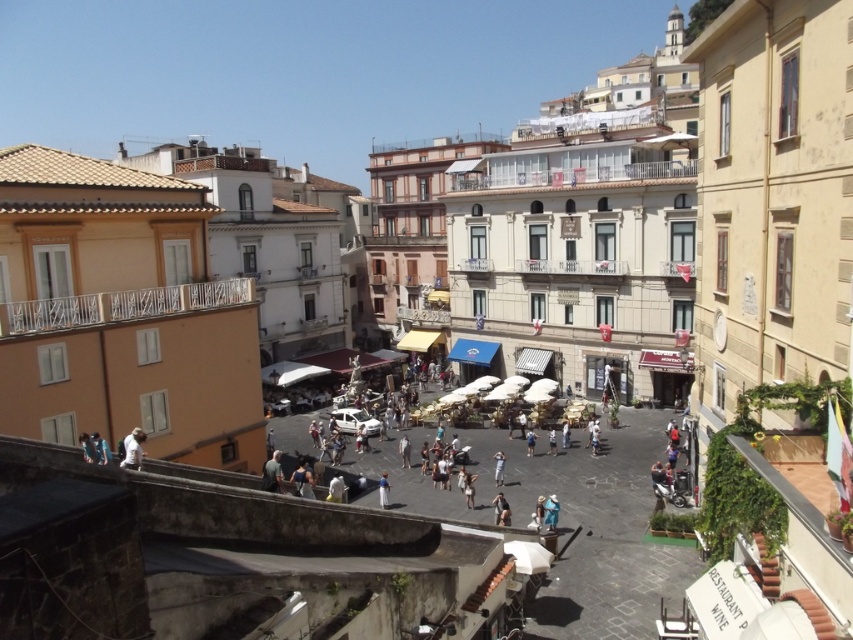
Question: Is dark gray fabric jacket at lower left smaller than white cotton shirt at center?

Choices:
 (A) yes
 (B) no

Answer: (B)

Question: In this image, where is dark gray fabric jacket at lower left located relative to white cotton shirt at center?

Choices:
 (A) below
 (B) above

Answer: (B)

Question: Does white fabric shirt at lower left appear on the left side of dark gray fabric bag at center?

Choices:
 (A) yes
 (B) no

Answer: (A)

Question: Which of the following is the farthest from the observer?

Choices:
 (A) white cotton shirt at center
 (B) dark gray fabric bag at center

Answer: (A)

Question: Which point is closer to the camera?

Choices:
 (A) dark gray fabric jacket at lower left
 (B) blue fabric shirt at center

Answer: (A)

Question: Which point appears farthest from the camera in this image?

Choices:
 (A) (500, 472)
 (B) (496, 515)
 (C) (135, 433)
 (D) (380, 506)

Answer: (A)